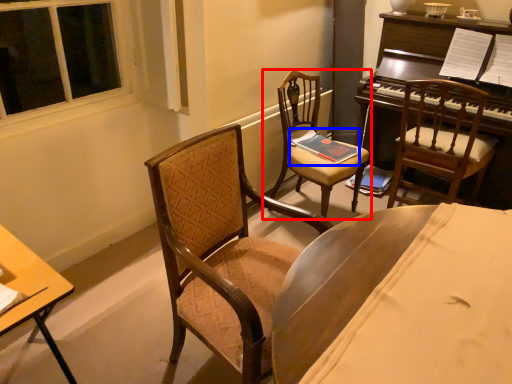
Question: Which object appears farthest to the camera in this image, chair (highlighted by a red box) or book (highlighted by a blue box)?

Choices:
 (A) chair
 (B) book

Answer: (B)